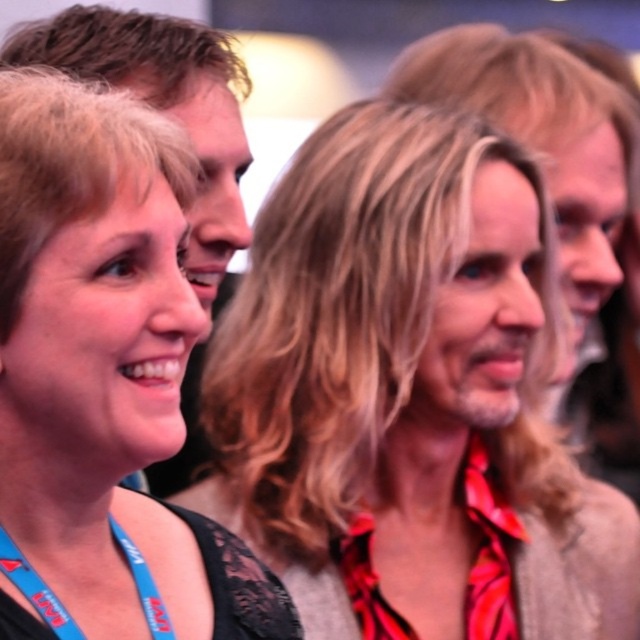
You are organizing a photo shoot and need to ensure that all participants have their lanyards visible. Given that the matte black shirt at center is wider than the matte black lanyard at left, will the lanyard be fully visible if the participant turns sideways?

The matte black shirt at center is wider than the matte black lanyard at left, so if the participant turns sideways, the lanyard may be partially hidden by the wider shirt. Ensure the lanyard is positioned to avoid being covered by the shirt.